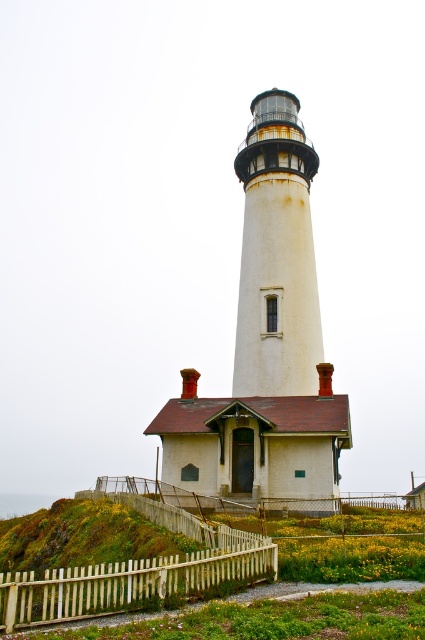
Is white wooden picket fence at lower center smaller than green grass at lower center?

Actually, white wooden picket fence at lower center might be larger than green grass at lower center.

Locate an element on the screen. white wooden picket fence at lower center is located at coordinates (133, 580).

This screenshot has height=640, width=425. What do you see at coordinates (133, 580) in the screenshot?
I see `white wooden picket fence at lower center` at bounding box center [133, 580].

Identify the location of white wooden picket fence at lower center. (133, 580).

Is white textured lighthouse at center closer to camera compared to green grass at lower center?

No, it is not.

Which is behind, point (258, 243) or point (252, 611)?

Point (258, 243)

This screenshot has width=425, height=640. Identify the location of white textured lighthouse at center. (277, 256).

Find the location of a particular element. The height and width of the screenshot is (640, 425). white textured lighthouse at center is located at coordinates (277, 256).

Consider the image. Can you confirm if white painted wood lighthouse at center is positioned below white wooden picket fence at lower center?

No, white painted wood lighthouse at center is not below white wooden picket fence at lower center.

Is white painted wood lighthouse at center further to camera compared to white wooden picket fence at lower center?

Yes, it is behind white wooden picket fence at lower center.

Measure the distance between point (x=312, y=282) and camera.

The distance of point (x=312, y=282) from camera is 51.19 meters.

The image size is (425, 640). I want to click on white painted wood lighthouse at center, so click(266, 340).